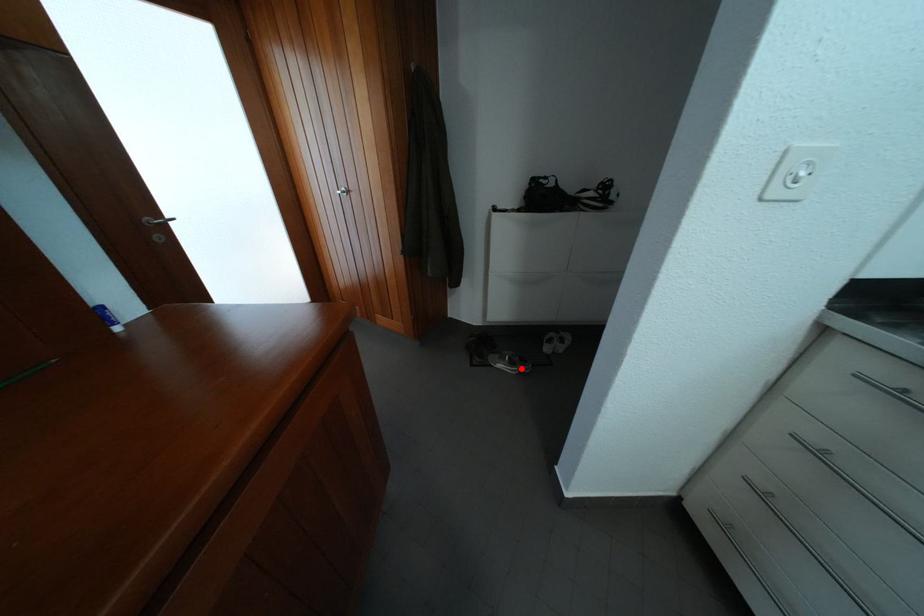
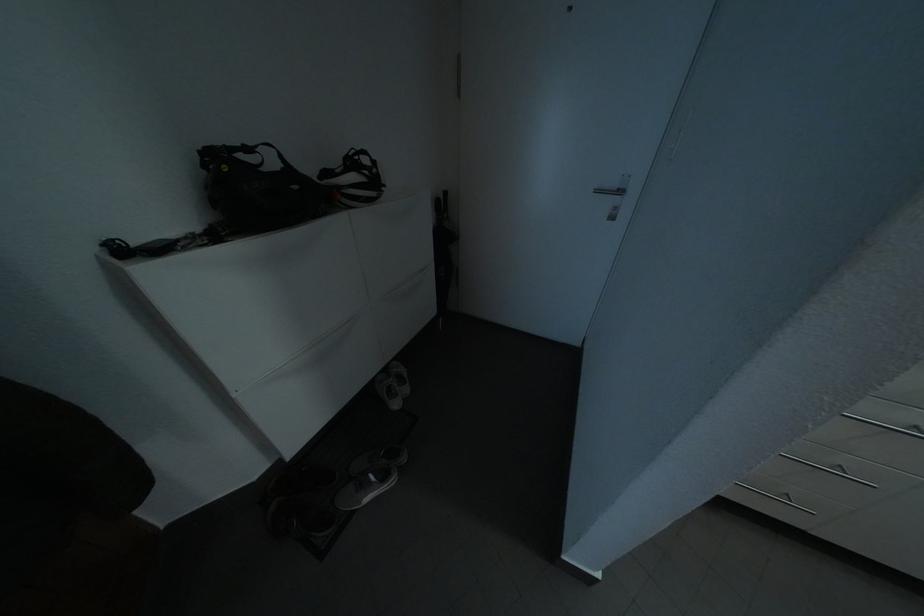
Locate, in the second image, the point that corresponds to the highlighted location in the first image.

(393, 483)